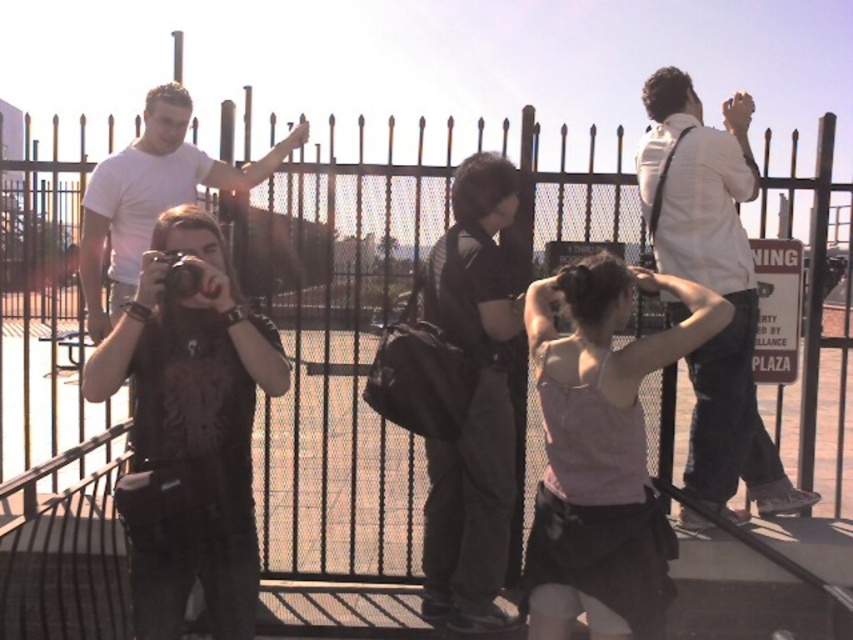
You are standing at the point with coordinates point (x=144, y=132) and want to walk to point (x=181, y=262). Which direction should you move in?

You should move away from the camera because point (x=181, y=262) is closer to the camera than point (x=144, y=132).

You are a photographer trying to decide which item to place in your bag first. The pink fabric tank top at center and the black matte backpack at center are both in your view. Which item has a greater width?

The pink fabric tank top at center has a greater width than the black matte backpack at center.

You are a photographer trying to position your equipment. You have a pink fabric tank top at center and a black matte backpack at center. Given that your camera requires 24 inches of space to set up, can you fit both items within the required space?

The distance between the pink fabric tank top at center and the black matte backpack at center is 22.72 inches, which is less than the required 24 inches. Therefore, you can fit both items within the required space.